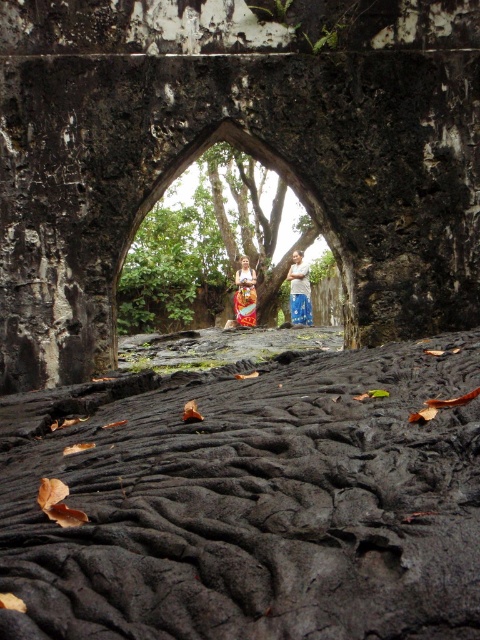
In the scene shown: You are standing in front of the archway and notice a specific point marked at coordinates (250,500). What object is located at that point?

The black textured rock at lower center is located at point (250,500).

You are standing in front of the archway and notice a specific point marked at coordinates (250, 500). Based on the scene description, can you determine what surface this point is located on?

The point at coordinates (250, 500) is on the black textured rock at lower center.

You are standing in front of the stone archway and notice two items on the ground. You see the black textured rock at lower center and the blue denim jeans at center. Which object is larger in size?

The black textured rock at lower center is bigger than the blue denim jeans at center.